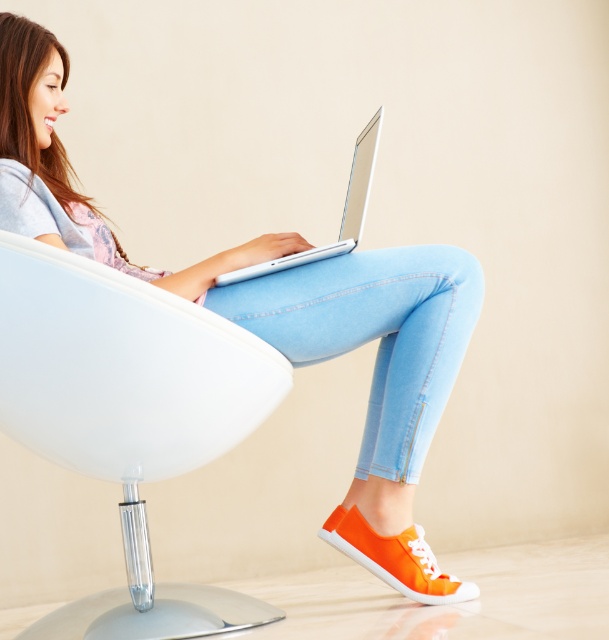
Does point (438, 269) come closer to viewer compared to point (233, 323)?

No, it is not.

This screenshot has width=609, height=640. Describe the element at coordinates (276, 312) in the screenshot. I see `matte white laptop at center` at that location.

I want to click on matte white laptop at center, so click(276, 312).

This screenshot has width=609, height=640. Identify the location of matte white laptop at center. (276, 312).

Is point (82, 429) farther from camera compared to point (225, 284)?

No.

Can you confirm if white plastic swivel chair at center is wider than silver metallic laptop at center?

Indeed, white plastic swivel chair at center has a greater width compared to silver metallic laptop at center.

Does point (261, 611) come closer to viewer compared to point (347, 205)?

Yes, point (261, 611) is closer to viewer.

Where is `white plastic swivel chair at center`? white plastic swivel chair at center is located at coordinates (122, 371).

What do you see at coordinates (276, 312) in the screenshot? The image size is (609, 640). I see `matte white laptop at center` at bounding box center [276, 312].

Consider the image. Can you confirm if matte white laptop at center is wider than silver metallic laptop at center?

Indeed, matte white laptop at center has a greater width compared to silver metallic laptop at center.

Which is in front, point (400, 276) or point (357, 243)?

Point (357, 243) is more forward.

You are a GUI agent. You are given a task and a screenshot of the screen. Output one action in this format:
    pyautogui.click(x=<x>, y=<y>)
    Task: Click on the matte white laptop at center
    
    Given the screenshot: What is the action you would take?
    pyautogui.click(x=276, y=312)